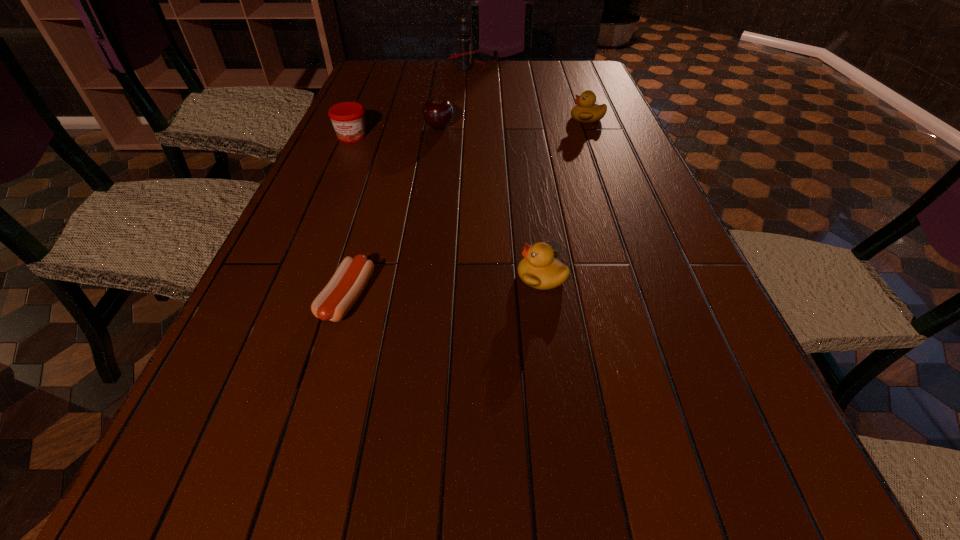
Find the location of a particular element. The width and height of the screenshot is (960, 540). object that is at the far edge is located at coordinates (464, 58).

At what (x,y) coordinates should I click in order to perform the action: click on jam present at the left edge. Please return your answer as a coordinate pair (x, y). Looking at the image, I should click on (348, 118).

Identify the location of sausage that is at the left edge. (337, 298).

You are a GUI agent. You are given a task and a screenshot of the screen. Output one action in this format:
    pyautogui.click(x=<x>, y=<y>)
    Task: Click on the object positioned at the right edge
    The height and width of the screenshot is (540, 960).
    Given the screenshot: What is the action you would take?
    pyautogui.click(x=586, y=111)

Image resolution: width=960 pixels, height=540 pixels. In order to click on free region at the left edge of the desktop in this screenshot , I will do `click(380, 108)`.

Locate an element on the screen. This screenshot has height=540, width=960. free space at the right edge is located at coordinates (723, 332).

In the image, there is a desktop. Identify the location of free space at the far left corner. (381, 83).

I want to click on free space between the shortest object and the nearer duckling, so click(444, 287).

The width and height of the screenshot is (960, 540). Identify the location of free point between the leftmost object and the fifth object from right to left. (349, 217).

Where is `vacant area that lies between the leftmost object and the fifth object from right to left`? The height and width of the screenshot is (540, 960). vacant area that lies between the leftmost object and the fifth object from right to left is located at coordinates (349, 217).